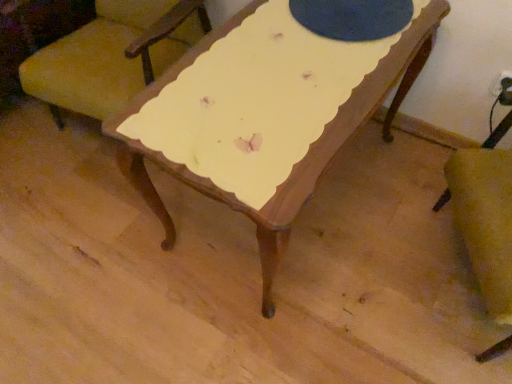
How much space does velvet yellow armchair at lower right, which is the 2th chair in left-to-right order, occupy vertically?

velvet yellow armchair at lower right, which is the 2th chair in left-to-right order, is 79.85 centimeters tall.

What do you see at coordinates (498, 131) in the screenshot?
I see `velvet yellow armchair at lower right, which is the 2th chair in left-to-right order` at bounding box center [498, 131].

Where is `velvet yellow armchair at lower right, which is the 1th chair from right to left`? The image size is (512, 384). velvet yellow armchair at lower right, which is the 1th chair from right to left is located at coordinates (498, 131).

How much space does yellow fabric chair at upper left, the second chair in the right-to-left sequence, occupy vertically?

yellow fabric chair at upper left, the second chair in the right-to-left sequence, is 31.41 inches tall.

Describe the element at coordinates (113, 55) in the screenshot. The image size is (512, 384). I see `yellow fabric chair at upper left, the 1th chair in the left-to-right sequence` at that location.

Image resolution: width=512 pixels, height=384 pixels. Identify the location of yellow fabric chair at upper left, the 1th chair in the left-to-right sequence. coord(113,55).

Where is `velvet yellow armchair at lower right, which is the 1th chair from right to left`? velvet yellow armchair at lower right, which is the 1th chair from right to left is located at coordinates (498, 131).

Can you confirm if yellow fabric chair at upper left, the second chair in the right-to-left sequence, is positioned to the right of velvet yellow armchair at lower right, which is the 2th chair in left-to-right order?

Incorrect, yellow fabric chair at upper left, the second chair in the right-to-left sequence, is not on the right side of velvet yellow armchair at lower right, which is the 2th chair in left-to-right order.

In the scene shown: Between yellow fabric chair at upper left, the second chair in the right-to-left sequence, and velvet yellow armchair at lower right, which is the 1th chair from right to left, which one is positioned in front?

Positioned in front is velvet yellow armchair at lower right, which is the 1th chair from right to left.

Between point (180, 30) and point (437, 208), which one is positioned behind?

The point (180, 30) is farther from the camera.

From the image's perspective, relative to velvet yellow armchair at lower right, which is the 1th chair from right to left, is yellow fabric chair at upper left, the 1th chair in the left-to-right sequence, above or below?

From the image's perspective, yellow fabric chair at upper left, the 1th chair in the left-to-right sequence, appears above velvet yellow armchair at lower right, which is the 1th chair from right to left.

From a real-world perspective, between yellow fabric chair at upper left, the second chair in the right-to-left sequence, and velvet yellow armchair at lower right, which is the 2th chair in left-to-right order, who is vertically higher?

From a 3D spatial view, yellow fabric chair at upper left, the second chair in the right-to-left sequence, is above.

Which of these two, yellow fabric chair at upper left, the second chair in the right-to-left sequence, or velvet yellow armchair at lower right, which is the 2th chair in left-to-right order, is thinner?

With smaller width is velvet yellow armchair at lower right, which is the 2th chair in left-to-right order.

Which of these two, yellow fabric chair at upper left, the second chair in the right-to-left sequence, or velvet yellow armchair at lower right, which is the 1th chair from right to left, stands shorter?

yellow fabric chair at upper left, the second chair in the right-to-left sequence, is shorter.

Can you confirm if yellow fabric chair at upper left, the 1th chair in the left-to-right sequence, is smaller than velvet yellow armchair at lower right, which is the 2th chair in left-to-right order?

Actually, yellow fabric chair at upper left, the 1th chair in the left-to-right sequence, might be larger than velvet yellow armchair at lower right, which is the 2th chair in left-to-right order.

Is yellow fabric chair at upper left, the second chair in the right-to-left sequence, situated inside velvet yellow armchair at lower right, which is the 2th chair in left-to-right order, or outside?

yellow fabric chair at upper left, the second chair in the right-to-left sequence, is outside velvet yellow armchair at lower right, which is the 2th chair in left-to-right order.

Based on the photo, is yellow fabric chair at upper left, the second chair in the right-to-left sequence, next to velvet yellow armchair at lower right, which is the 1th chair from right to left, and touching it?

yellow fabric chair at upper left, the second chair in the right-to-left sequence, and velvet yellow armchair at lower right, which is the 1th chair from right to left, are clearly separated.

Does yellow fabric chair at upper left, the second chair in the right-to-left sequence, turn towards velvet yellow armchair at lower right, which is the 2th chair in left-to-right order?

No, yellow fabric chair at upper left, the second chair in the right-to-left sequence, is not oriented towards velvet yellow armchair at lower right, which is the 2th chair in left-to-right order.

What's the angular difference between yellow fabric chair at upper left, the second chair in the right-to-left sequence, and velvet yellow armchair at lower right, which is the 2th chair in left-to-right order,'s facing directions?

The angle between the facing direction of yellow fabric chair at upper left, the second chair in the right-to-left sequence, and the facing direction of velvet yellow armchair at lower right, which is the 2th chair in left-to-right order, is 62.7 degrees.

Where is `chair in front of the yellow fabric chair at upper left, the 1th chair in the left-to-right sequence`? The height and width of the screenshot is (384, 512). chair in front of the yellow fabric chair at upper left, the 1th chair in the left-to-right sequence is located at coordinates (498, 131).

Is velvet yellow armchair at lower right, which is the 1th chair from right to left, at the left side of yellow fabric chair at upper left, the 1th chair in the left-to-right sequence?

No, velvet yellow armchair at lower right, which is the 1th chair from right to left, is not to the left of yellow fabric chair at upper left, the 1th chair in the left-to-right sequence.

Which object is further away from the camera, velvet yellow armchair at lower right, which is the 1th chair from right to left, or yellow fabric chair at upper left, the second chair in the right-to-left sequence?

Positioned behind is yellow fabric chair at upper left, the second chair in the right-to-left sequence.

Is point (506, 350) closer to viewer compared to point (204, 32)?

That is True.

From the image's perspective, is velvet yellow armchair at lower right, which is the 2th chair in left-to-right order, positioned above or below yellow fabric chair at upper left, the second chair in the right-to-left sequence?

velvet yellow armchair at lower right, which is the 2th chair in left-to-right order, is situated lower than yellow fabric chair at upper left, the second chair in the right-to-left sequence, in the image.

From a real-world perspective, between velvet yellow armchair at lower right, which is the 2th chair in left-to-right order, and yellow fabric chair at upper left, the second chair in the right-to-left sequence, who is vertically higher?

From a 3D spatial view, yellow fabric chair at upper left, the second chair in the right-to-left sequence, is above.

Between velvet yellow armchair at lower right, which is the 2th chair in left-to-right order, and yellow fabric chair at upper left, the 1th chair in the left-to-right sequence, which one has larger width?

yellow fabric chair at upper left, the 1th chair in the left-to-right sequence.

Who is shorter, velvet yellow armchair at lower right, which is the 1th chair from right to left, or yellow fabric chair at upper left, the 1th chair in the left-to-right sequence?

Standing shorter between the two is yellow fabric chair at upper left, the 1th chair in the left-to-right sequence.

Is velvet yellow armchair at lower right, which is the 2th chair in left-to-right order, smaller than yellow fabric chair at upper left, the second chair in the right-to-left sequence?

Yes, velvet yellow armchair at lower right, which is the 2th chair in left-to-right order, is smaller than yellow fabric chair at upper left, the second chair in the right-to-left sequence.

Would you say velvet yellow armchair at lower right, which is the 1th chair from right to left, contains yellow fabric chair at upper left, the 1th chair in the left-to-right sequence?

Actually, yellow fabric chair at upper left, the 1th chair in the left-to-right sequence, is outside velvet yellow armchair at lower right, which is the 1th chair from right to left.

Are velvet yellow armchair at lower right, which is the 1th chair from right to left, and yellow fabric chair at upper left, the second chair in the right-to-left sequence, far apart?

Yes.

Is velvet yellow armchair at lower right, which is the 2th chair in left-to-right order, looking in the opposite direction of yellow fabric chair at upper left, the second chair in the right-to-left sequence?

No, velvet yellow armchair at lower right, which is the 2th chair in left-to-right order, is not facing away from yellow fabric chair at upper left, the second chair in the right-to-left sequence.

Can you tell me how much velvet yellow armchair at lower right, which is the 1th chair from right to left, and yellow fabric chair at upper left, the 1th chair in the left-to-right sequence, differ in facing direction?

The angular difference between velvet yellow armchair at lower right, which is the 1th chair from right to left, and yellow fabric chair at upper left, the 1th chair in the left-to-right sequence, is 62.7 degrees.

You are a GUI agent. You are given a task and a screenshot of the screen. Output one action in this format:
    pyautogui.click(x=<x>, y=<y>)
    Task: Click on the chair below the yellow fabric chair at upper left, the 1th chair in the left-to-right sequence (from a real-world perspective)
    The width and height of the screenshot is (512, 384).
    Given the screenshot: What is the action you would take?
    pyautogui.click(x=498, y=131)

You are a GUI agent. You are given a task and a screenshot of the screen. Output one action in this format:
    pyautogui.click(x=<x>, y=<y>)
    Task: Click on the chair below the yellow fabric chair at upper left, the 1th chair in the left-to-right sequence (from a real-world perspective)
    This screenshot has height=384, width=512.
    Given the screenshot: What is the action you would take?
    pyautogui.click(x=498, y=131)

Locate an element on the screen. Image resolution: width=512 pixels, height=384 pixels. chair that appears above the velvet yellow armchair at lower right, which is the 2th chair in left-to-right order (from the image's perspective) is located at coordinates (113, 55).